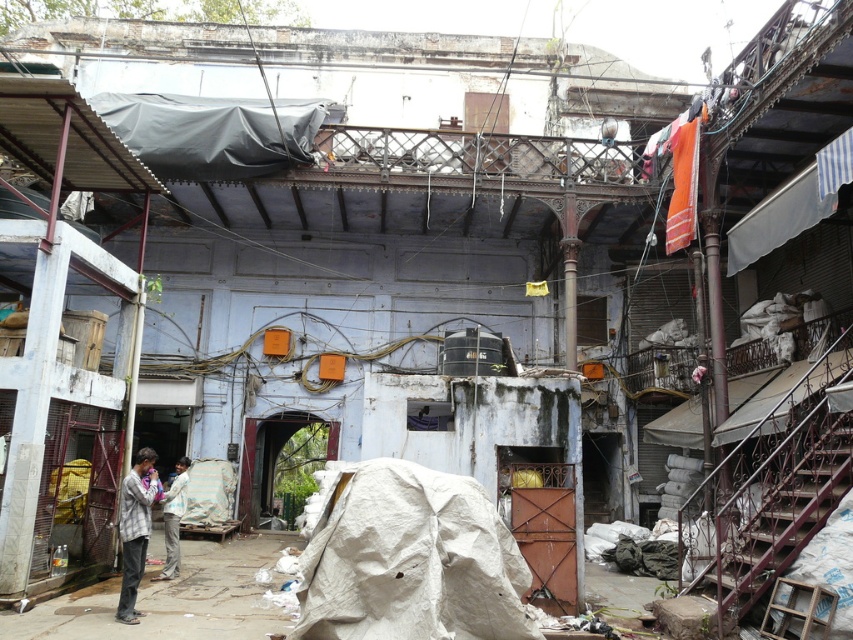
Question: Which of the following is the farthest from the observer?

Choices:
 (A) (177, 570)
 (B) (142, 547)

Answer: (A)

Question: Does plaid fabric shirt at lower left have a lesser width compared to light brown fabric pants at lower left?

Choices:
 (A) yes
 (B) no

Answer: (B)

Question: Observing the image, what is the correct spatial positioning of plaid fabric shirt at lower left in reference to light brown fabric pants at lower left?

Choices:
 (A) right
 (B) left

Answer: (A)

Question: Is plaid fabric shirt at lower left smaller than light brown fabric pants at lower left?

Choices:
 (A) no
 (B) yes

Answer: (A)

Question: Which point is farther to the camera?

Choices:
 (A) light brown fabric pants at lower left
 (B) plaid fabric shirt at lower left

Answer: (A)

Question: Among these objects, which one is farthest from the camera?

Choices:
 (A) plaid fabric shirt at lower left
 (B) light brown fabric pants at lower left

Answer: (B)